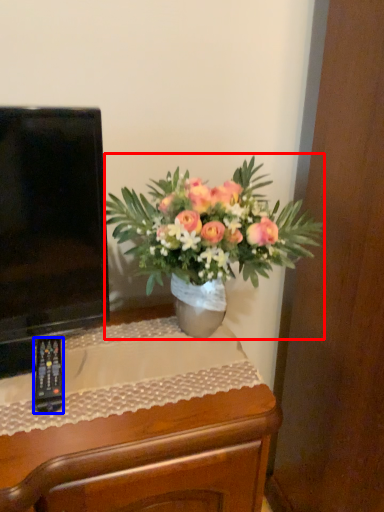
Question: Which object is closer to the camera taking this photo, houseplant (highlighted by a red box) or remote control (highlighted by a blue box)?

Choices:
 (A) houseplant
 (B) remote control

Answer: (A)